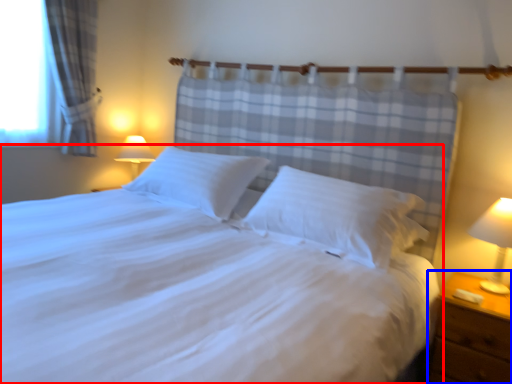
Question: Which object is closer to the camera taking this photo, bed (highlighted by a red box) or nightstand (highlighted by a blue box)?

Choices:
 (A) bed
 (B) nightstand

Answer: (A)